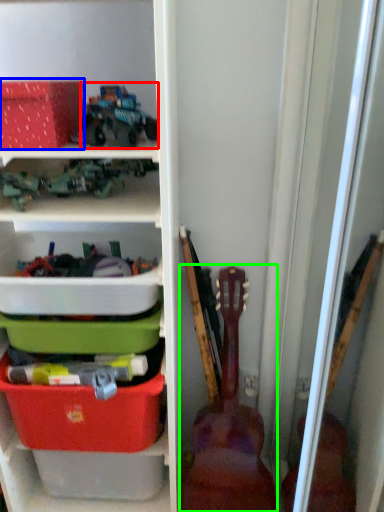
Question: Considering the real-world distances, which object is farthest from toy (highlighted by a red box)? storage box (highlighted by a blue box) or guitar (highlighted by a green box)?

Choices:
 (A) storage box
 (B) guitar

Answer: (B)